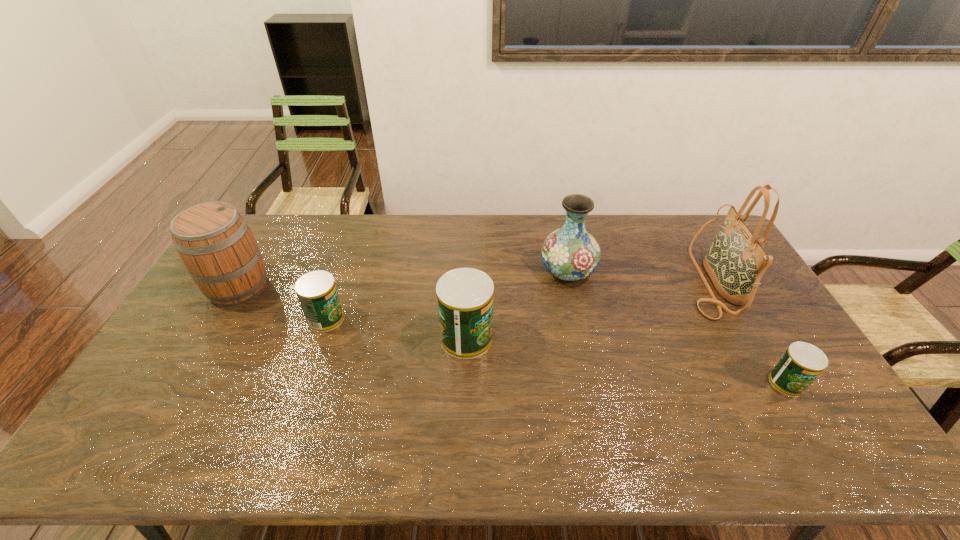
Where is `object that is at the left edge`? The width and height of the screenshot is (960, 540). object that is at the left edge is located at coordinates pyautogui.click(x=214, y=242).

The height and width of the screenshot is (540, 960). Find the location of `can that is at the right edge`. can that is at the right edge is located at coordinates (801, 364).

The height and width of the screenshot is (540, 960). In order to click on handbag positioned at the right edge in this screenshot , I will do `click(735, 262)`.

Find the location of `object at the far right corner`. object at the far right corner is located at coordinates (735, 262).

Find the location of a particular element. object that is positioned at the near right corner is located at coordinates (801, 364).

This screenshot has height=540, width=960. Identify the location of vacant region at the far edge. (425, 218).

Locate an element on the screen. Image resolution: width=960 pixels, height=540 pixels. free space at the near edge of the desktop is located at coordinates (186, 416).

Identify the location of vacant position at the left edge of the desktop. (193, 327).

Locate an element on the screen. free space at the right edge of the desktop is located at coordinates (748, 319).

The height and width of the screenshot is (540, 960). I want to click on vacant area at the near left corner, so click(x=188, y=404).